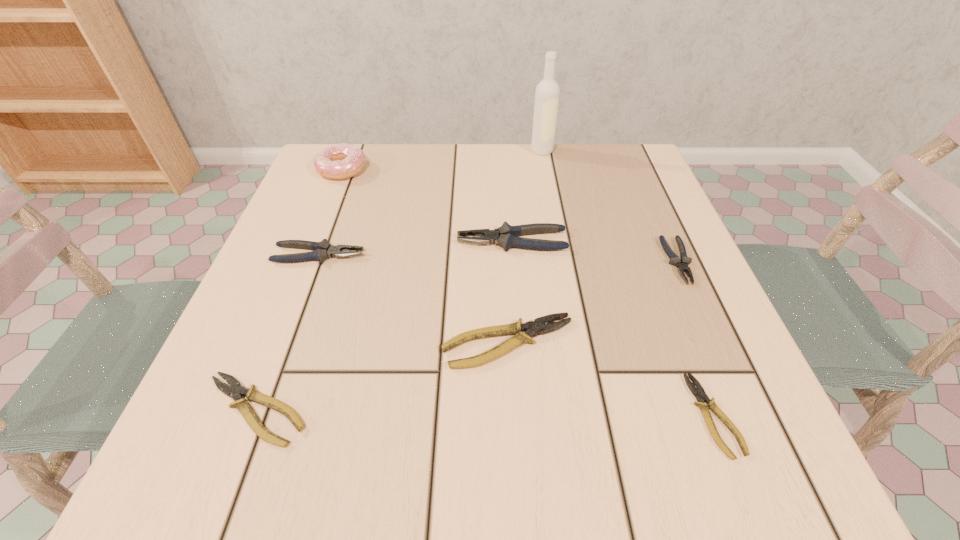
You are a GUI agent. You are given a task and a screenshot of the screen. Output one action in this format:
    pyautogui.click(x=<x>, y=<y>)
    Task: Click on the vodka
    The height and width of the screenshot is (540, 960).
    Given the screenshot: What is the action you would take?
    pyautogui.click(x=547, y=93)

In order to click on the tallest object in this screenshot , I will do `click(547, 93)`.

Locate an element on the screen. The width and height of the screenshot is (960, 540). the seventh shortest object is located at coordinates (340, 161).

The image size is (960, 540). What are the coordinates of `doughnut` in the screenshot? It's located at (x=340, y=161).

Where is `the second gray pliers from left to right`? This screenshot has height=540, width=960. the second gray pliers from left to right is located at coordinates (505, 236).

This screenshot has width=960, height=540. What are the coordinates of `the third tallest object` in the screenshot? It's located at (505, 236).

Image resolution: width=960 pixels, height=540 pixels. Identify the location of the fourth tallest object. (323, 250).

Where is `the second smallest gray pliers`? the second smallest gray pliers is located at coordinates (323, 250).

Find the location of a particular element. the third nearest object is located at coordinates (532, 328).

Locate an element on the screen. The height and width of the screenshot is (540, 960). the farthest yellow pliers is located at coordinates (532, 328).